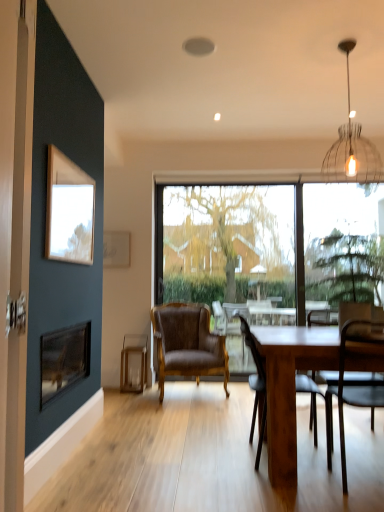
This screenshot has height=512, width=384. Identify the location of vacant space underneath wooden picture frame at upper left, the first picture frame positioned from the front (from a real-world perspective). (67, 422).